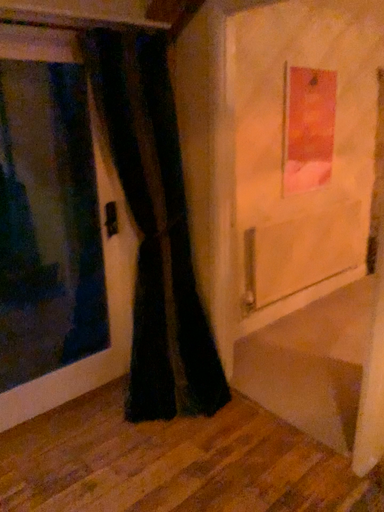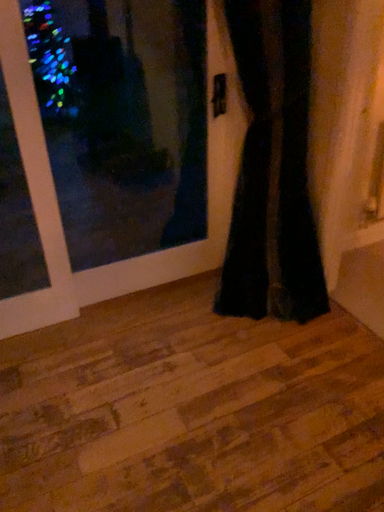
Question: Which way did the camera rotate in the video?

Choices:
 (A) rotated upward
 (B) rotated downward

Answer: (B)